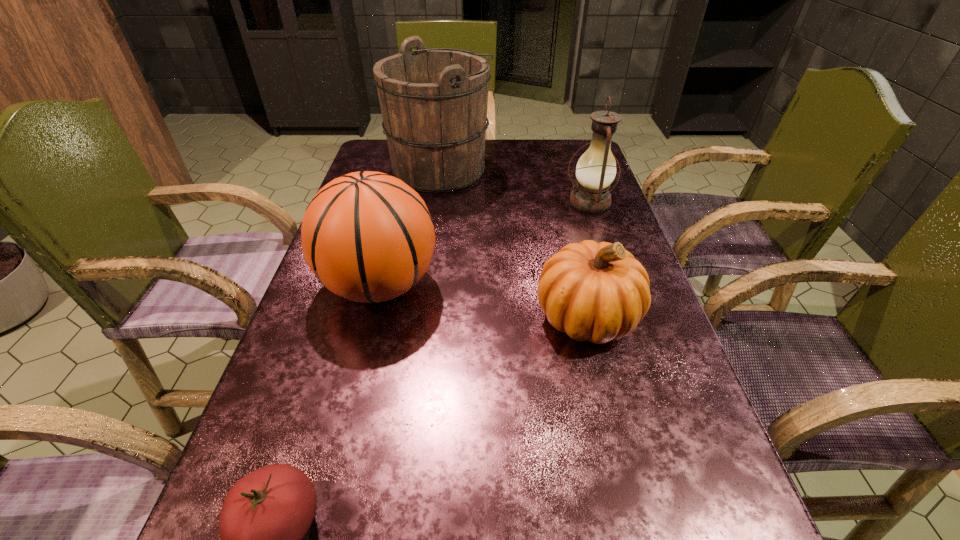
You are a GUI agent. You are given a task and a screenshot of the screen. Output one action in this format:
    pyautogui.click(x=<x>, y=<y>)
    Task: Click on the vacant space that's between the oil lamp and the tallest object
    
    Given the screenshot: What is the action you would take?
    tap(515, 186)

This screenshot has height=540, width=960. What are the coordinates of `free space between the basketball and the oil lamp` in the screenshot? It's located at (485, 244).

Identify the location of empty space that is in between the pumpkin and the bucket. This screenshot has width=960, height=540. (514, 243).

You are a GUI agent. You are given a task and a screenshot of the screen. Output one action in this format:
    pyautogui.click(x=<x>, y=<y>)
    Task: Click on the object that is the second closest to the basketball
    The width and height of the screenshot is (960, 540).
    Given the screenshot: What is the action you would take?
    pyautogui.click(x=433, y=102)

The height and width of the screenshot is (540, 960). Identify the location of the closest object relative to the basketball. (599, 292).

Where is `vacant space that satisfies the following two spatial constraints: 1. on the back side of the basketball; 2. on the right side of the tallest object`? vacant space that satisfies the following two spatial constraints: 1. on the back side of the basketball; 2. on the right side of the tallest object is located at coordinates (408, 170).

I want to click on blank space that satisfies the following two spatial constraints: 1. on the front side of the basketball; 2. on the right side of the fourth tallest object, so click(372, 317).

This screenshot has width=960, height=540. Find the location of `free location that satisfies the following two spatial constraints: 1. on the back side of the oil lamp; 2. on the left side of the pumpkin`. free location that satisfies the following two spatial constraints: 1. on the back side of the oil lamp; 2. on the left side of the pumpkin is located at coordinates (559, 202).